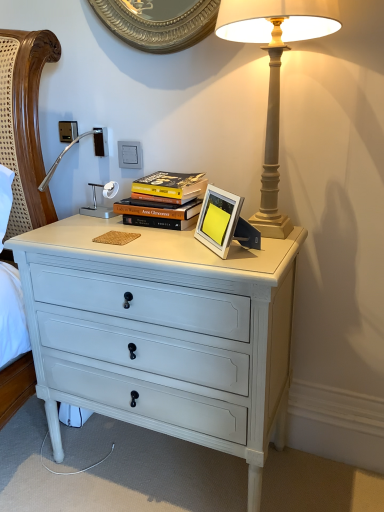
Question: Can you confirm if white painted wood chest of drawers at center is positioned to the right of white plastic electric outlet at upper center?

Choices:
 (A) no
 (B) yes

Answer: (B)

Question: From a real-world perspective, is white painted wood chest of drawers at center positioned under white plastic electric outlet at upper center based on gravity?

Choices:
 (A) no
 (B) yes

Answer: (B)

Question: From the image's perspective, does white painted wood chest of drawers at center appear lower than white plastic electric outlet at upper center?

Choices:
 (A) no
 (B) yes

Answer: (B)

Question: From the image's perspective, would you say white painted wood chest of drawers at center is positioned over white plastic electric outlet at upper center?

Choices:
 (A) no
 (B) yes

Answer: (A)

Question: Is the position of white painted wood chest of drawers at center more distant than that of white plastic electric outlet at upper center?

Choices:
 (A) no
 (B) yes

Answer: (A)

Question: Is white plastic electric outlet at upper center in front of or behind silver metallic picture frame at center in the image?

Choices:
 (A) behind
 (B) front

Answer: (A)

Question: Considering the positions of white plastic electric outlet at upper center and silver metallic picture frame at center in the image, is white plastic electric outlet at upper center bigger or smaller than silver metallic picture frame at center?

Choices:
 (A) small
 (B) big

Answer: (A)

Question: Choose the correct answer: Is white plastic electric outlet at upper center inside silver metallic picture frame at center or outside it?

Choices:
 (A) inside
 (B) outside

Answer: (B)

Question: From the image's perspective, relative to silver metallic picture frame at center, is white plastic electric outlet at upper center above or below?

Choices:
 (A) above
 (B) below

Answer: (A)

Question: Considering the positions of point (190, 174) and point (273, 110), is point (190, 174) closer or farther from the camera than point (273, 110)?

Choices:
 (A) farther
 (B) closer

Answer: (A)

Question: From their relative heights in the image, would you say hardcover books at center is taller or shorter than matte beige lamp at upper right?

Choices:
 (A) short
 (B) tall

Answer: (A)

Question: From the image's perspective, relative to matte beige lamp at upper right, is hardcover books at center above or below?

Choices:
 (A) below
 (B) above

Answer: (A)

Question: From a real-world perspective, is hardcover books at center physically located above or below matte beige lamp at upper right?

Choices:
 (A) below
 (B) above

Answer: (A)

Question: Considering the positions of white plastic electric outlet at upper center and hardcover books at center in the image, is white plastic electric outlet at upper center taller or shorter than hardcover books at center?

Choices:
 (A) short
 (B) tall

Answer: (A)

Question: Considering the relative positions of white plastic electric outlet at upper center and hardcover books at center in the image provided, is white plastic electric outlet at upper center to the left or to the right of hardcover books at center?

Choices:
 (A) right
 (B) left

Answer: (B)